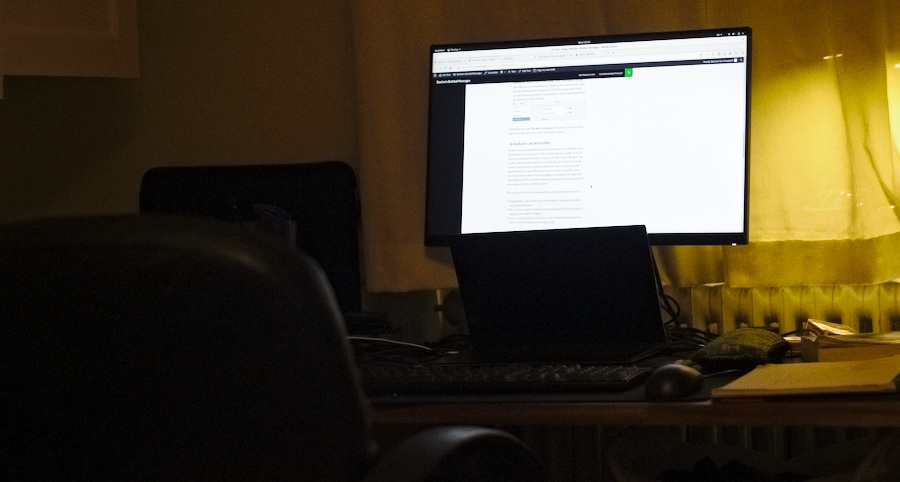
At what (x,y) coordinates should I click in order to perform the action: click on books. Please return your answer as a coordinate pair (x, y). This screenshot has height=482, width=900. Looking at the image, I should click on (820, 319), (831, 338), (814, 373).